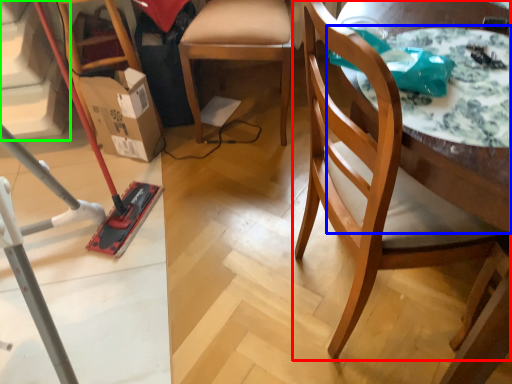
Question: Based on their relative distances, which object is farther from chair (highlighted by a red box)? Choose from round table (highlighted by a blue box) and stairwell (highlighted by a green box).

Choices:
 (A) round table
 (B) stairwell

Answer: (B)